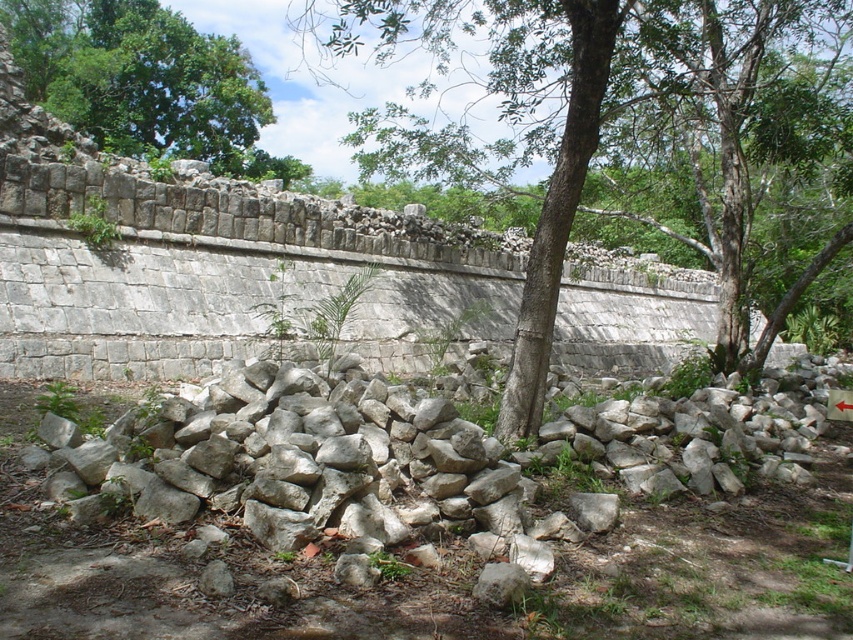
Between white rough stones at center and green rough bark tree at center, which one is positioned higher?

green rough bark tree at center

Can you confirm if white rough stones at center is bigger than green rough bark tree at center?

Incorrect, white rough stones at center is not larger than green rough bark tree at center.

Does point (277, 508) lie in front of point (508, 403)?

Yes, point (277, 508) is closer to viewer.

Locate an element on the screen. The image size is (853, 640). white rough stones at center is located at coordinates (428, 460).

Is white rough stones at center shorter than green leafy tree at upper left?

Yes, white rough stones at center is shorter than green leafy tree at upper left.

Does white rough stones at center appear on the right side of green leafy tree at upper left?

Indeed, white rough stones at center is positioned on the right side of green leafy tree at upper left.

This screenshot has height=640, width=853. Describe the element at coordinates (428, 460) in the screenshot. I see `white rough stones at center` at that location.

The image size is (853, 640). Identify the location of white rough stones at center. (428, 460).

Is green rough bark tree at center closer to camera compared to green leafy tree at upper left?

That is True.

Which is more to the right, green rough bark tree at center or green leafy tree at upper left?

green rough bark tree at center is more to the right.

The height and width of the screenshot is (640, 853). Find the location of `green rough bark tree at center`. green rough bark tree at center is located at coordinates (596, 124).

Where is `green rough bark tree at center`? green rough bark tree at center is located at coordinates (596, 124).